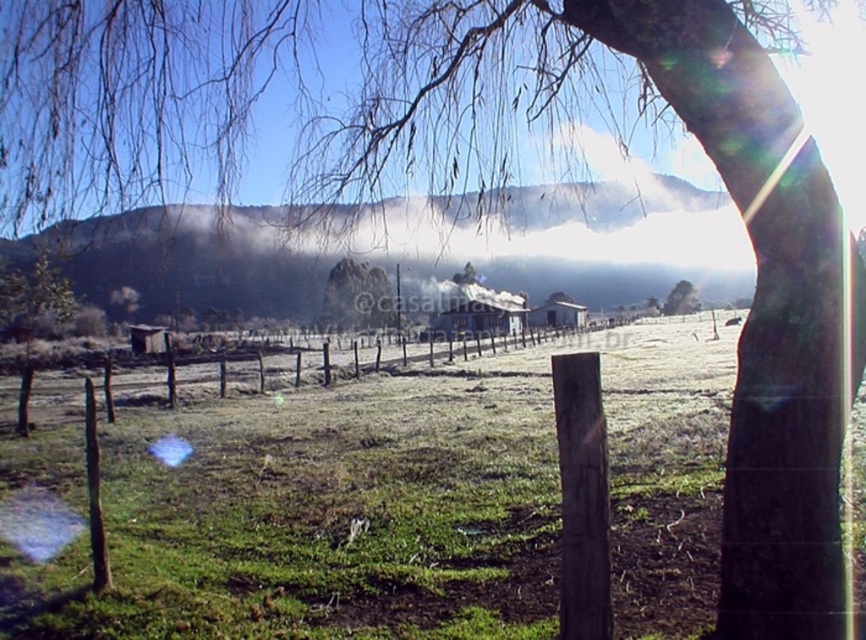
Which is behind, point (339, 262) or point (677, 296)?

Point (677, 296)

Who is taller, smooth gray rock at center or green matte tree at center?

With more height is smooth gray rock at center.

Where is `smooth gray rock at center`? The height and width of the screenshot is (640, 866). smooth gray rock at center is located at coordinates (356, 296).

Where is `smooth gray rock at center`? This screenshot has height=640, width=866. smooth gray rock at center is located at coordinates (356, 296).

Is brown wooden fence at center smaller than green matte tree at left?

Actually, brown wooden fence at center might be larger than green matte tree at left.

Is brown wooden fence at center to the left of green matte tree at left from the viewer's perspective?

Incorrect, brown wooden fence at center is not on the left side of green matte tree at left.

Locate an element on the screen. The width and height of the screenshot is (866, 640). brown wooden fence at center is located at coordinates (427, 372).

Who is more forward, (36,305) or (664,300)?

Point (36,305) is more forward.

Measure the distance from green matte tree at left to green matte tree at center.

The distance of green matte tree at left from green matte tree at center is 186.47 feet.

Is point (31, 308) positioned in front of point (674, 285)?

That is True.

This screenshot has width=866, height=640. In order to click on green matte tree at left in this screenshot , I will do `click(33, 300)`.